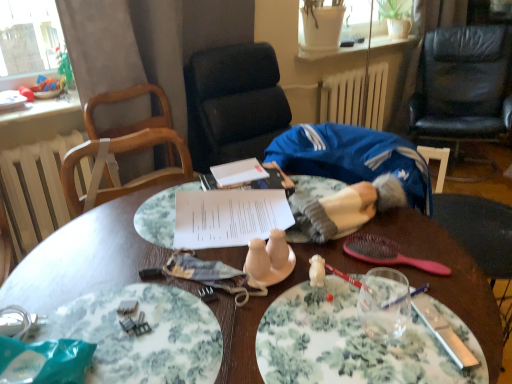
This screenshot has width=512, height=384. I want to click on vacant area that lies in front of white ceramic salt and pepper shakers at center, so click(260, 334).